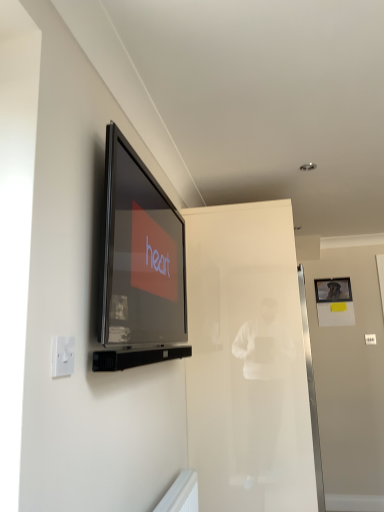
Question: Is white plastic electric outlet at lower left not near metallic silver picture frame at upper right?

Choices:
 (A) no
 (B) yes

Answer: (B)

Question: Is white plastic electric outlet at lower left to the right of metallic silver picture frame at upper right from the viewer's perspective?

Choices:
 (A) yes
 (B) no

Answer: (B)

Question: From a real-world perspective, is white plastic electric outlet at lower left over metallic silver picture frame at upper right?

Choices:
 (A) yes
 (B) no

Answer: (B)

Question: From the image's perspective, would you say white plastic electric outlet at lower left is shown under metallic silver picture frame at upper right?

Choices:
 (A) yes
 (B) no

Answer: (B)

Question: Is metallic silver picture frame at upper right at the back of white plastic electric outlet at lower left?

Choices:
 (A) no
 (B) yes

Answer: (A)

Question: Considering the relative positions of white plastic electric outlet at lower left and metallic silver picture frame at upper right in the image provided, is white plastic electric outlet at lower left in front of metallic silver picture frame at upper right?

Choices:
 (A) yes
 (B) no

Answer: (A)

Question: From the image's perspective, does matte black television at upper left appear lower than metallic silver picture frame at upper right?

Choices:
 (A) no
 (B) yes

Answer: (A)

Question: Is matte black television at upper left at the left side of metallic silver picture frame at upper right?

Choices:
 (A) no
 (B) yes

Answer: (B)

Question: Are matte black television at upper left and metallic silver picture frame at upper right making contact?

Choices:
 (A) yes
 (B) no

Answer: (B)

Question: Is matte black television at upper left oriented towards metallic silver picture frame at upper right?

Choices:
 (A) no
 (B) yes

Answer: (A)

Question: From the image's perspective, is matte black television at upper left located above metallic silver picture frame at upper right?

Choices:
 (A) yes
 (B) no

Answer: (A)

Question: Is matte black television at upper left outside of metallic silver picture frame at upper right?

Choices:
 (A) no
 (B) yes

Answer: (B)

Question: Is transparent glass door at center wider than white plastic electric outlet at lower left?

Choices:
 (A) no
 (B) yes

Answer: (B)